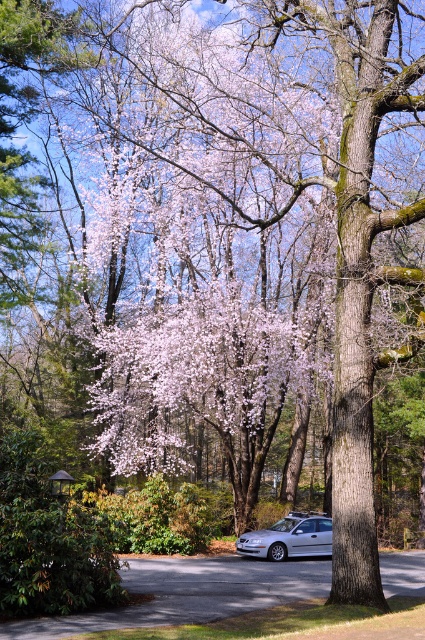
Who is higher up, gray asphalt driveway at lower center or silver metallic car at lower center?

Positioned higher is gray asphalt driveway at lower center.

The image size is (425, 640). In order to click on gray asphalt driveway at lower center in this screenshot , I will do `click(189, 593)`.

Between point (107, 625) and point (317, 531), which one is positioned in front?

Point (107, 625) is in front.

Where is `gray asphalt driveway at lower center`? This screenshot has width=425, height=640. gray asphalt driveway at lower center is located at coordinates (189, 593).